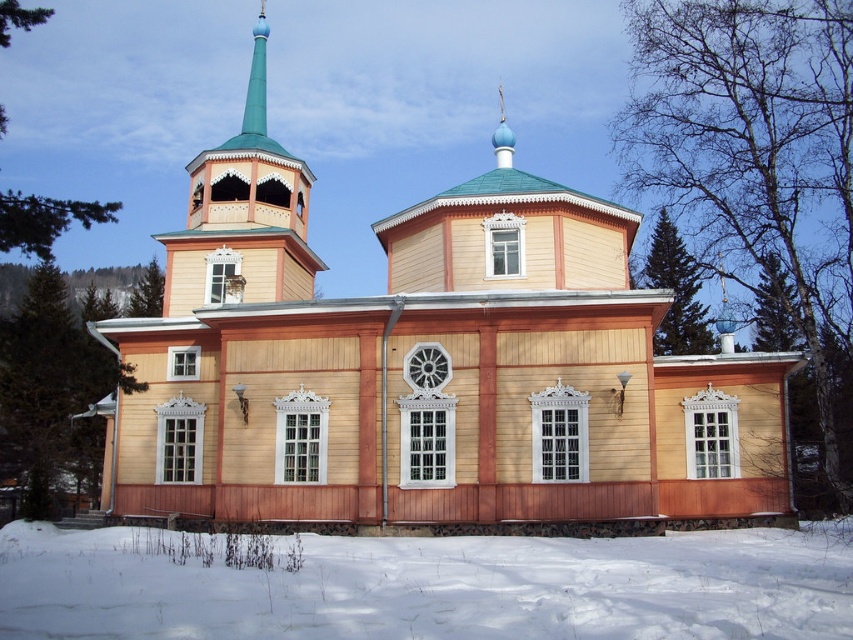
You are standing at the point marked by point (428, 365). What is the most prominent building in your immediate vicinity?

The wooden church at center is the most prominent building in your immediate vicinity as marked by point (428, 365).

You are a photographer trying to capture the wooden church at center and the white powdery snow at lower center in a single frame. Given that your camera has a fixed focal length, can you adjust your position so that both objects are fully visible without cropping? Explain your reasoning based on their sizes.

The wooden church at center is wider than the white powdery snow at lower center. Since the camera has a fixed focal length, adjusting your position closer to the snow or farther from the church might allow both to fit within the frame. However, without knowing the exact dimensions of the camera sensor or the distance, it is difficult to guarantee. But since the church is wider, positioning yourself farther back could ensure both are captured, as the snow would appear smaller relative to the church.